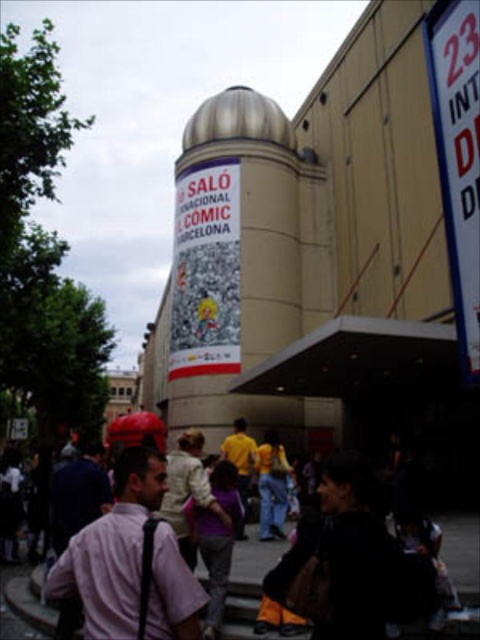
Between dark clothing crowd at center and white plastic sign at upper right, which one has less height?

dark clothing crowd at center is shorter.

Which is behind, point (340, 611) or point (452, 17)?

Point (452, 17)

What are the coordinates of `dark clothing crowd at center` in the screenshot? It's located at (131, 556).

Is dark clothing crowd at center to the left of pink cotton shirt at center from the viewer's perspective?

Indeed, dark clothing crowd at center is positioned on the left side of pink cotton shirt at center.

Between point (402, 579) and point (163, 570), which one is positioned behind?

The point (163, 570) is behind.

Locate an element on the screen. dark clothing crowd at center is located at coordinates (131, 556).

Which of these two, pink cotton shirt at center or white plastic sign at upper right, stands shorter?

pink cotton shirt at center is shorter.

What are the coordinates of `pink cotton shirt at center` in the screenshot? It's located at (131, 563).

Find the location of a particular element. Image resolution: width=480 pixels, height=640 pixels. pink cotton shirt at center is located at coordinates (131, 563).